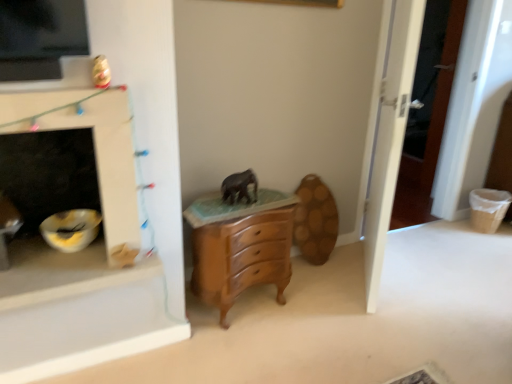
In order to click on free location to the right of white wooden door at right in this screenshot , I will do `click(436, 273)`.